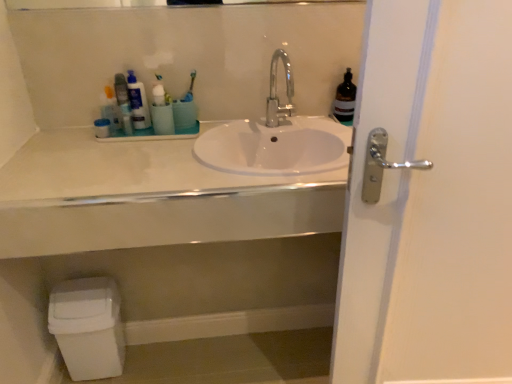
Where is `vacant area to the left of white plastic container at upper left, which is counted as the second toiletry, starting from the left`? The width and height of the screenshot is (512, 384). vacant area to the left of white plastic container at upper left, which is counted as the second toiletry, starting from the left is located at coordinates (53, 137).